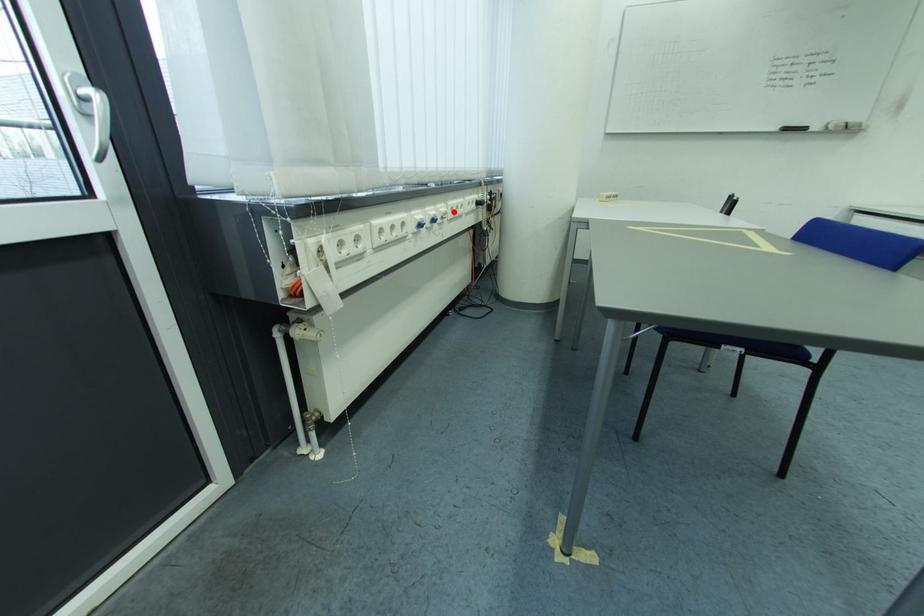
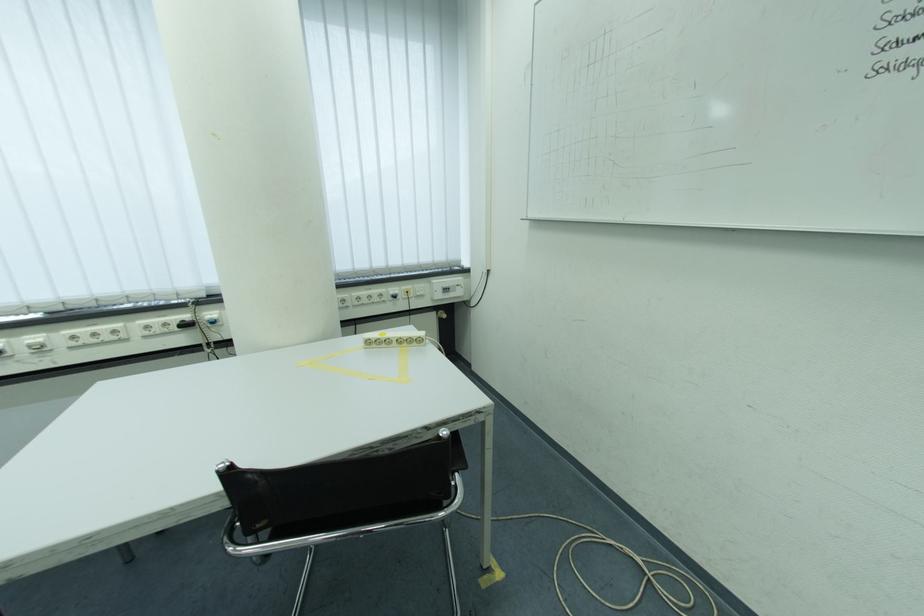
Find the pixel in the second image that matches the highlighted location in the first image.

(50, 342)